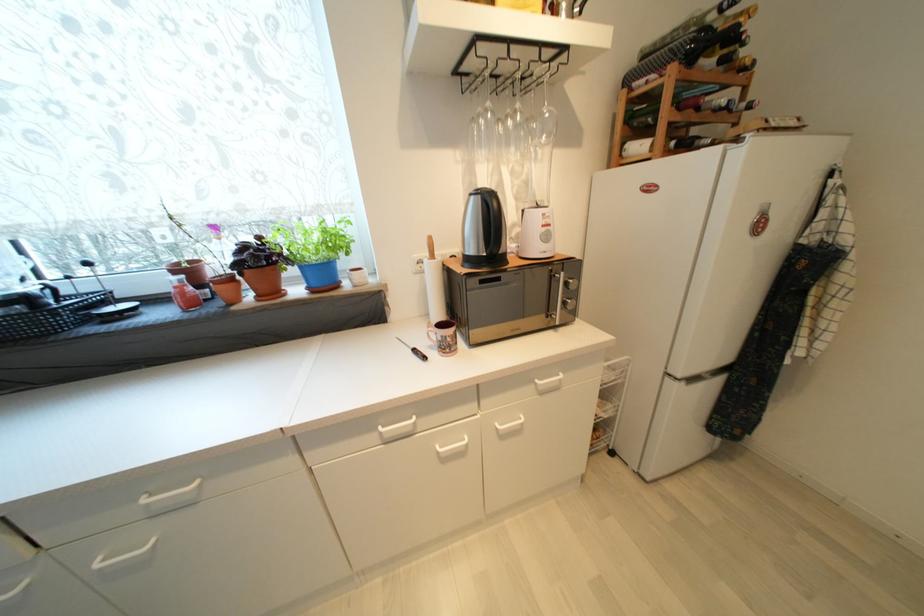
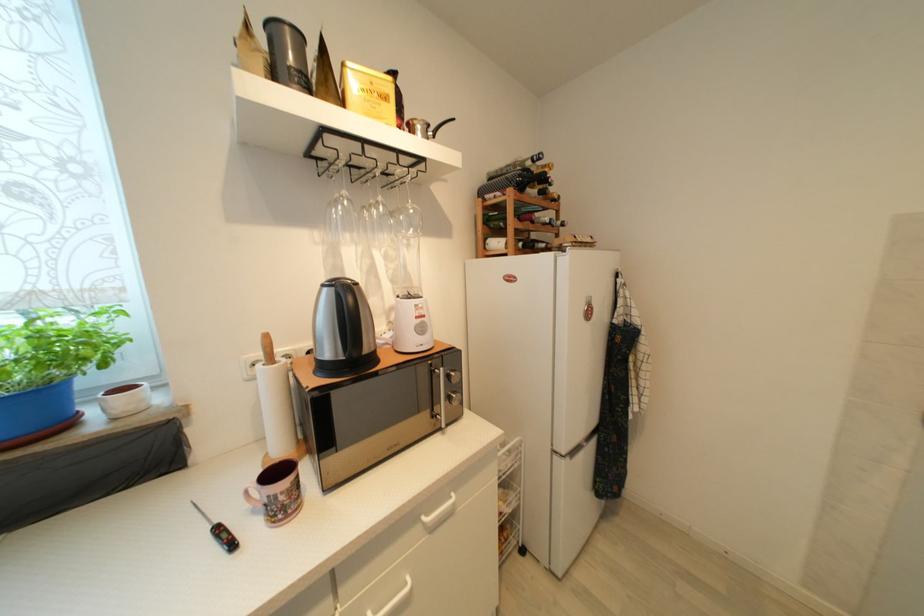
The point at [553,116] is marked in the first image. Where is the corresponding point in the second image?

(417, 213)